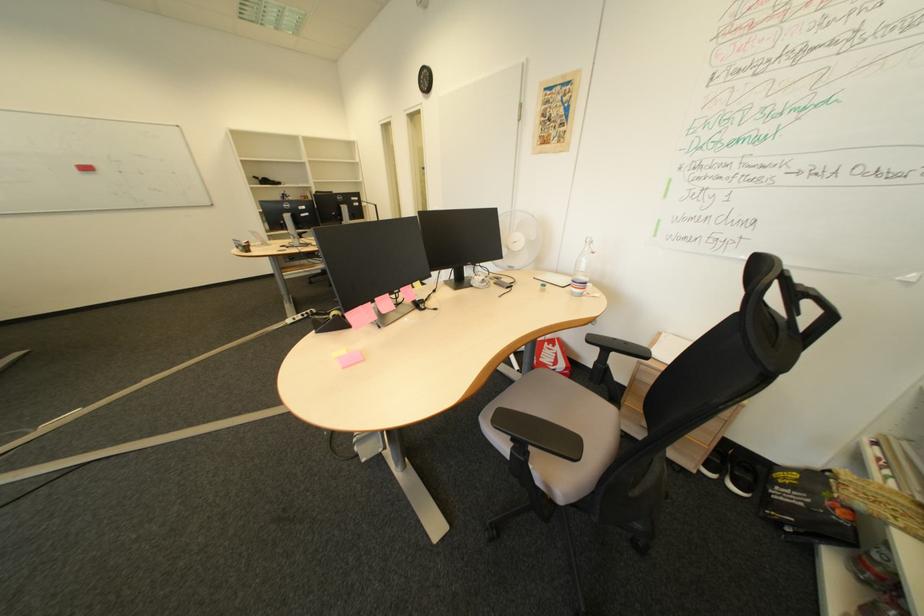
The height and width of the screenshot is (616, 924). Describe the element at coordinates (560, 440) in the screenshot. I see `the black chair armrest` at that location.